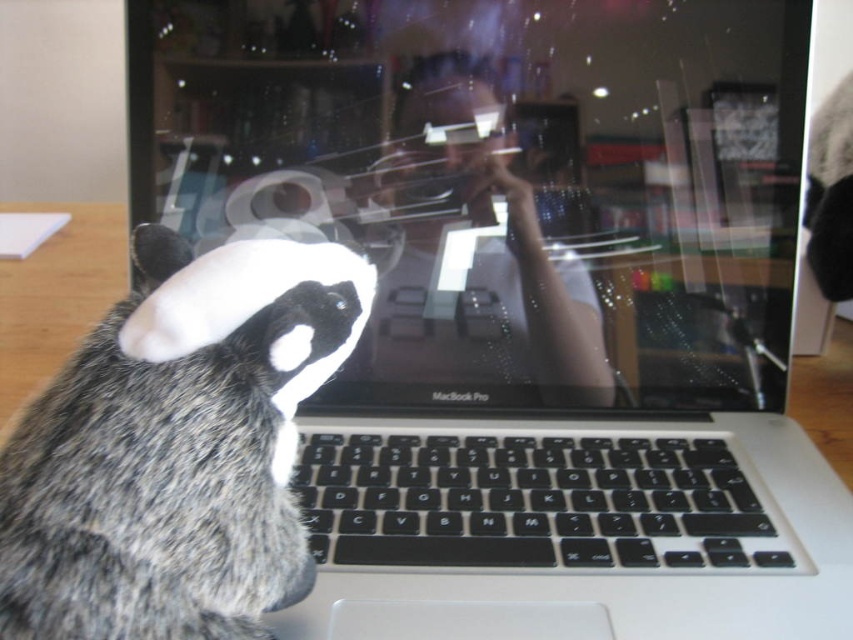
Question: Where is fuzzy fur cat at left located in relation to black plastic keyboard at center in the image?

Choices:
 (A) above
 (B) below

Answer: (A)

Question: Which of the following is the closest to the observer?

Choices:
 (A) black plastic keyboard at center
 (B) fuzzy fur cat at left

Answer: (B)

Question: Which object is closer to the camera taking this photo?

Choices:
 (A) fuzzy fur cat at left
 (B) black plastic keyboard at center

Answer: (A)

Question: Can you confirm if fuzzy fur cat at left is wider than black plastic keyboard at center?

Choices:
 (A) no
 (B) yes

Answer: (A)

Question: Observing the image, what is the correct spatial positioning of fuzzy fur cat at left in reference to black plastic keyboard at center?

Choices:
 (A) left
 (B) right

Answer: (A)